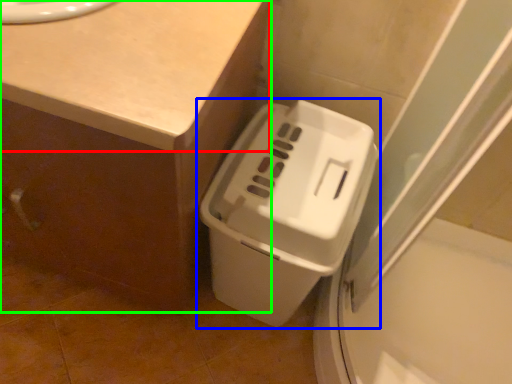
Question: Which object is positioned closest to counter top (highlighted by a red box)? Select from waste container (highlighted by a blue box) and counter (highlighted by a green box).

Choices:
 (A) waste container
 (B) counter

Answer: (B)